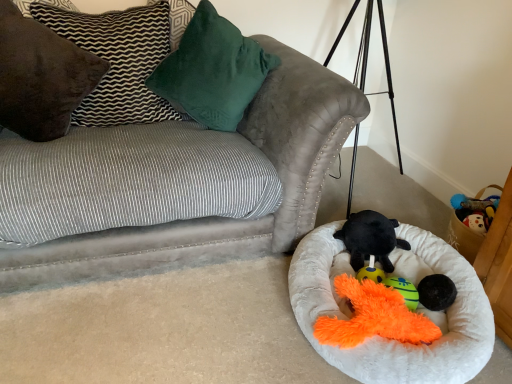
Locate an element on the screen. Image resolution: width=512 pixels, height=384 pixels. free space above orange plush toy at lower center (from a real-world perspective) is located at coordinates click(370, 297).